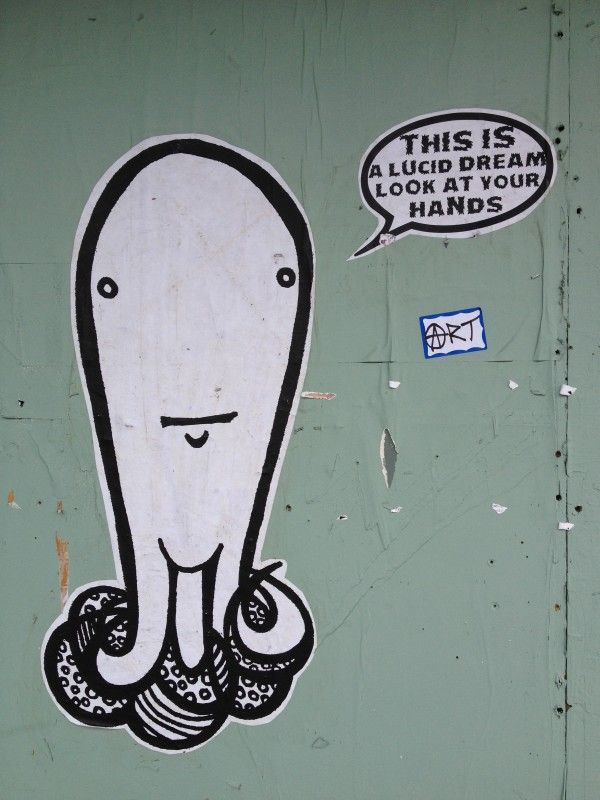
Identify the location of wall. This screenshot has height=800, width=600. (262, 94).